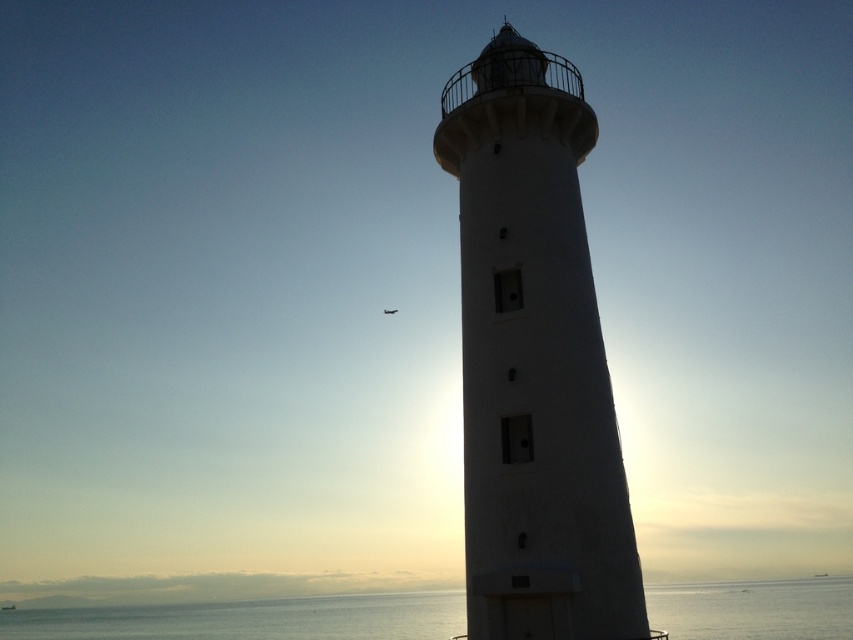
You are standing at the base of the lighthouse and want to take a photo of the lighthouse with the airplane in the background. The airplane is at point (480,67). What is the minimum distance you need to move forward to include the airplane in your photo?

The point (480,67) is 75.00 feet away from the camera. To include the airplane in the photo, you need to move forward until the airplane is within the camera frame. However, since the airplane is at a fixed point, the minimum distance to move forward would depend on the camera angle and field of view, which are not provided. Therefore, the exact distance cannot be determined with the given information.

You are a photographer trying to capture the reflection of the white smooth lighthouse at center in the transparent water at lower center. Is the lighthouse visible in the water?

The white smooth lighthouse at center is positioned over transparent water at lower center, so its reflection should be visible in the water.